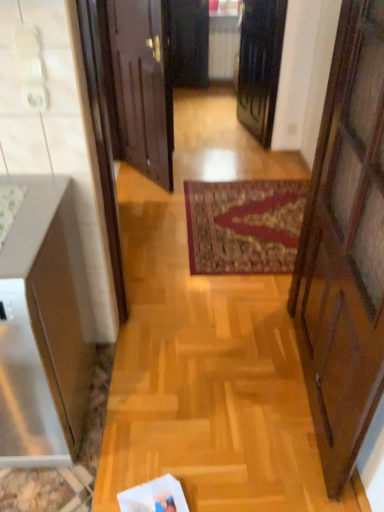
Question: Is wooden door at center, the 1th door when ordered from left to right, taller or shorter than black glossy door at center, which ranks as the second door in left-to-right order?

Choices:
 (A) short
 (B) tall

Answer: (B)

Question: Is point tap(130, 113) closer or farther from the camera than point tap(276, 82)?

Choices:
 (A) closer
 (B) farther

Answer: (A)

Question: Estimate the real-world distances between objects in this image. Which object is closer to the wooden door at center, acting as the 2th door starting from the right?

Choices:
 (A) matte white cabinet at left
 (B) black glossy door at center, the first door from the right

Answer: (B)

Question: Estimate the real-world distances between objects in this image. Which object is closer to the wooden door at center, acting as the 2th door starting from the right?

Choices:
 (A) matte white cabinet at left
 (B) black glossy door at center, the first door from the right

Answer: (B)